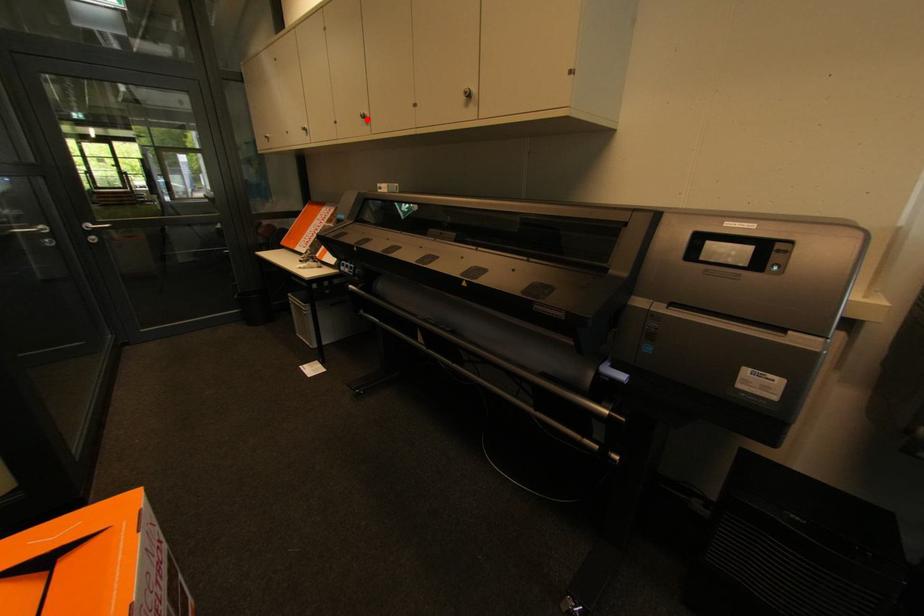
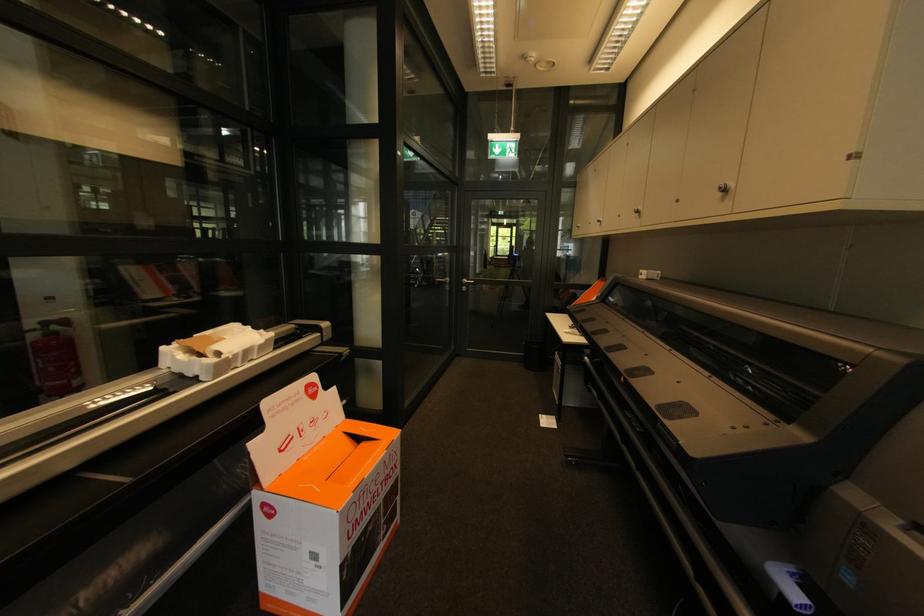
Where in the second image is the point corresponding to the highlighted location from the first image?

(640, 214)